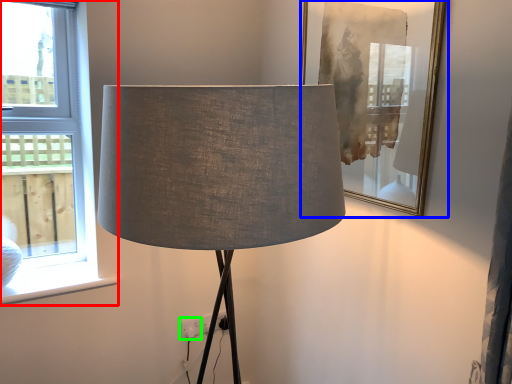
Question: Which object is the closest to the window (highlighted by a red box)? Choose among these: picture frame (highlighted by a blue box) or electric outlet (highlighted by a green box).

Choices:
 (A) picture frame
 (B) electric outlet

Answer: (B)